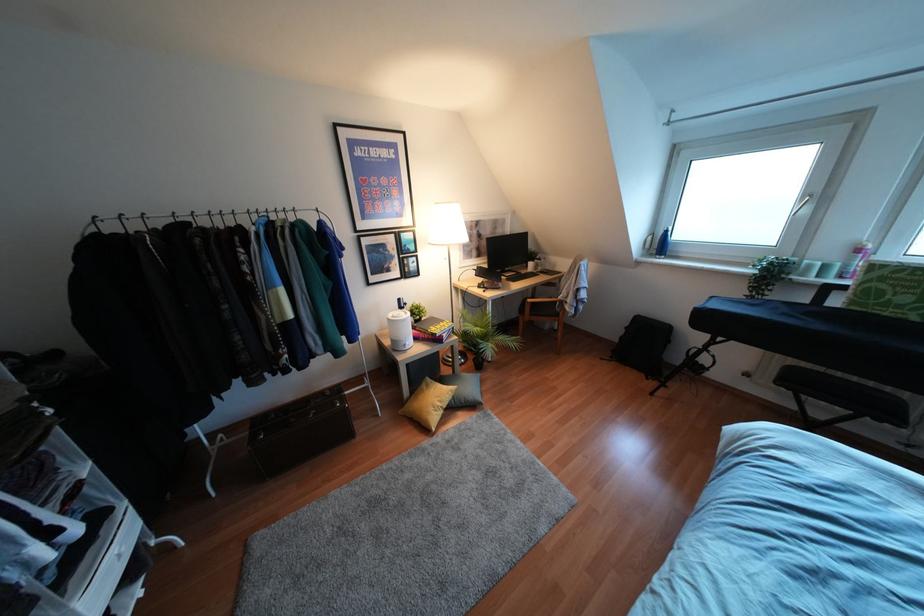
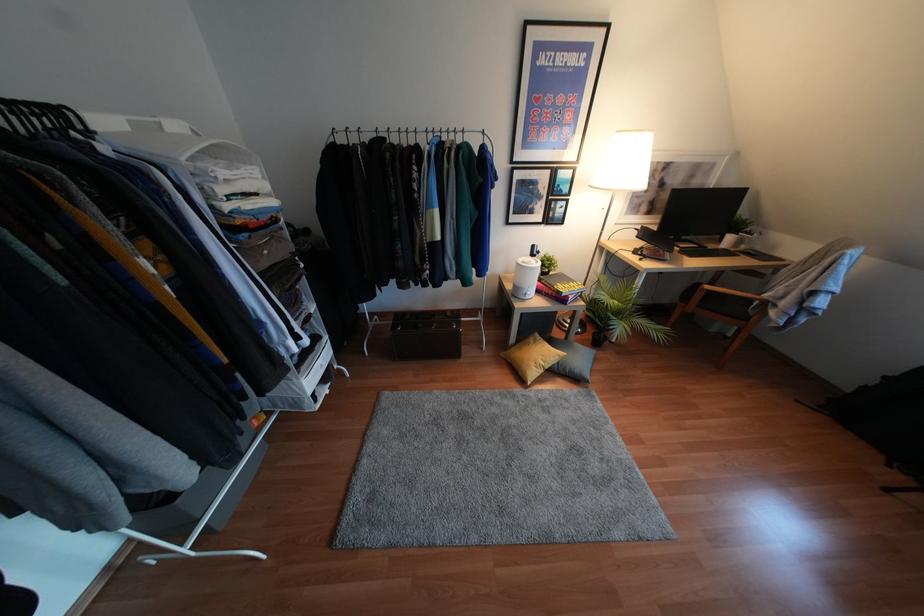
Find the pixel in the second image that matches (x=529, y=300) in the first image.

(707, 286)